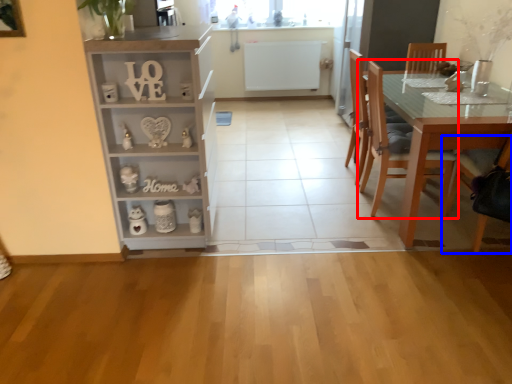
Question: Among these objects, which one is farthest to the camera, chair (highlighted by a red box) or chair (highlighted by a blue box)?

Choices:
 (A) chair
 (B) chair

Answer: (A)